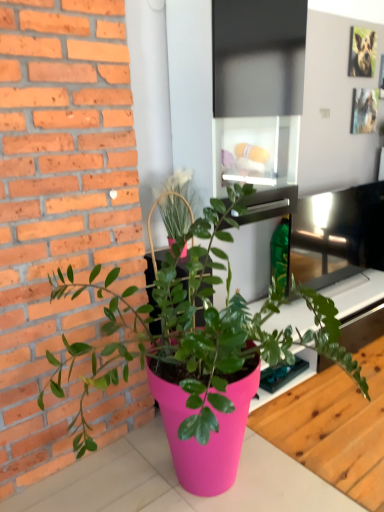
Question: Visually, is pink plastic table at lower center positioned to the left or to the right of pink matte pot at center?

Choices:
 (A) right
 (B) left

Answer: (A)

Question: Does point (334, 508) appear closer or farther from the camera than point (183, 463)?

Choices:
 (A) closer
 (B) farther

Answer: (A)

Question: Is pink plastic table at lower center in front of or behind pink matte pot at center in the image?

Choices:
 (A) front
 (B) behind

Answer: (B)

Question: In the image, is pink matte pot at center on the left side or the right side of pink plastic table at lower center?

Choices:
 (A) right
 (B) left

Answer: (B)

Question: From the image's perspective, is pink matte pot at center located above or below pink plastic table at lower center?

Choices:
 (A) above
 (B) below

Answer: (A)

Question: In terms of width, does pink matte pot at center look wider or thinner when compared to pink plastic table at lower center?

Choices:
 (A) wide
 (B) thin

Answer: (B)

Question: Is pink matte pot at center bigger or smaller than pink plastic table at lower center?

Choices:
 (A) small
 (B) big

Answer: (B)